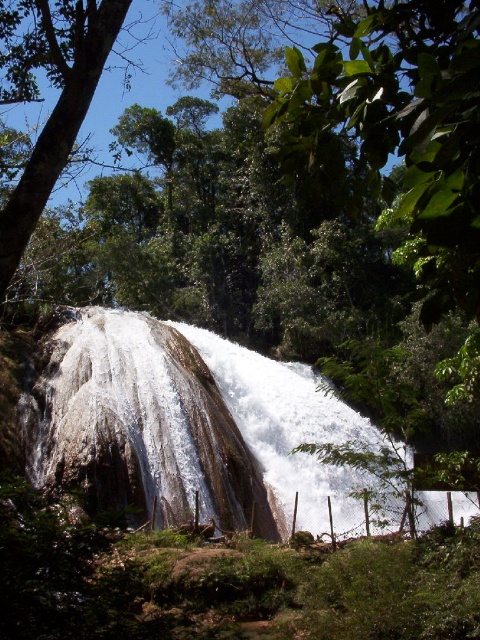
You are a hiker standing at the base of the white smooth waterfall at center and want to take a photo of the green leafy tree at upper left. Which object is closer to your camera lens when you aim at the tree?

The white smooth waterfall at center is closer to the camera lens than the green leafy tree at upper left because it is positioned in front of the tree from the viewer perspective.

You are standing at the base of the waterfall and want to determine which of the two points, point (105, 454) or point (71, 100), is closer to you. Based on the scene, which point is nearer?

Point (105, 454) is closer to you because it is further to the viewer than point (71, 100).

You are a drone operator trying to capture a photo of the white smooth waterfall at center. The camera has a fixed focus point at coordinate 0.662, 0.390. Will the waterfall be in focus?

The white smooth waterfall at center is positioned exactly at point (187, 422), so yes, the waterfall will be in focus.